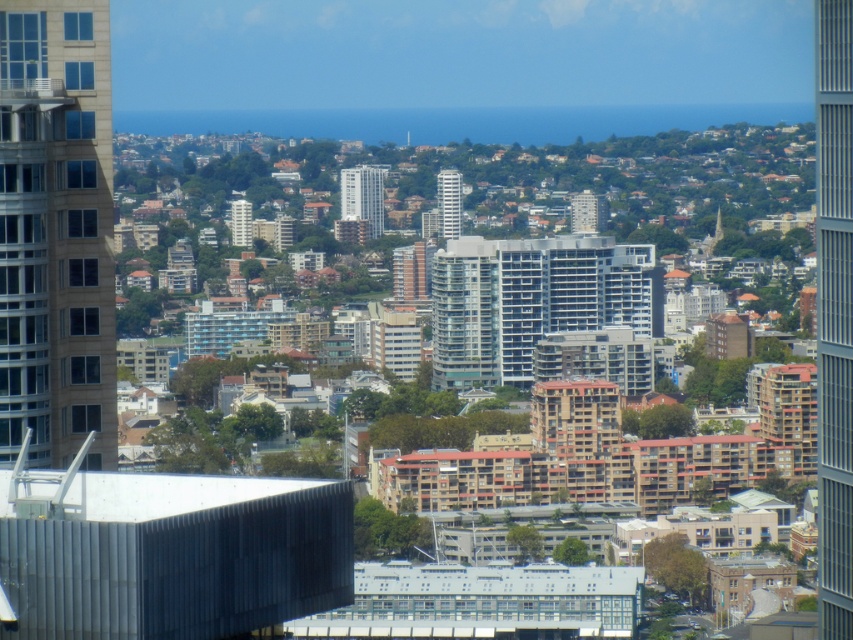
Question: Considering the real-world distances, which object is farthest from the white glossy building at center?

Choices:
 (A) matte glass building at center
 (B) matte gray building at center
 (C) glassy steel skyscraper at right

Answer: (C)

Question: Considering the real-world distances, which object is closest to the white glass tower at center?

Choices:
 (A) white glossy building at center
 (B) beige glass building at left
 (C) matte glass building at center

Answer: (A)

Question: Is glassy steel skyscraper at right to the left of matte glass building at center from the viewer's perspective?

Choices:
 (A) no
 (B) yes

Answer: (A)

Question: Which of the following is the closest to the observer?

Choices:
 (A) (840, 448)
 (B) (572, 202)

Answer: (B)

Question: Does white glossy building at center have a greater width compared to white glass tower at center?

Choices:
 (A) no
 (B) yes

Answer: (B)

Question: Does glassy steel skyscraper at right lie behind matte glass building at center?

Choices:
 (A) yes
 (B) no

Answer: (A)